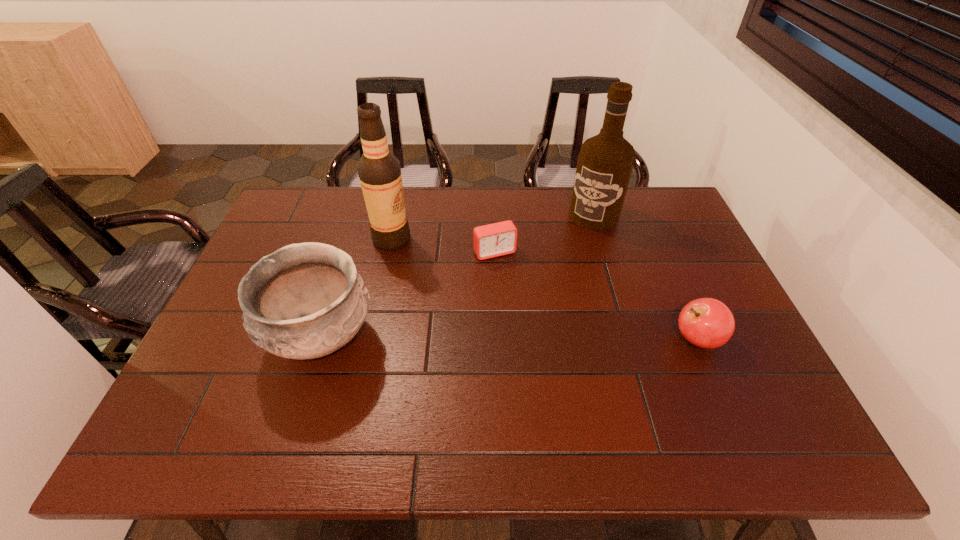
Locate an element on the screen. free spot that satisfies the following two spatial constraints: 1. on the front side of the pottery; 2. on the left side of the apple is located at coordinates (321, 339).